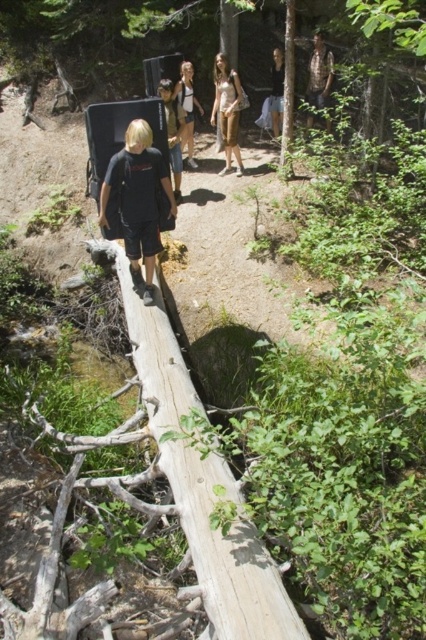
Between black matte shirt at center and light brown fabric dress at center, which one is positioned higher?

light brown fabric dress at center

Can you confirm if black matte shirt at center is taller than light brown fabric dress at center?

In fact, black matte shirt at center may be shorter than light brown fabric dress at center.

Locate an element on the screen. This screenshot has width=426, height=640. black matte shirt at center is located at coordinates pyautogui.click(x=138, y=202).

Can you confirm if black cotton shirt at center is smaller than light brown wooden log at center?

Actually, black cotton shirt at center might be larger than light brown wooden log at center.

Looking at this image, does black cotton shirt at center appear under light brown wooden log at center?

Yes.

Identify the location of black cotton shirt at center. (172, 131).

Can you confirm if camouflage fabric shirt at upper center is thinner than matte white tank top at center?

In fact, camouflage fabric shirt at upper center might be wider than matte white tank top at center.

Does camouflage fabric shirt at upper center have a larger size compared to matte white tank top at center?

Answer: Incorrect, camouflage fabric shirt at upper center is not larger than matte white tank top at center.

Find the location of `camouflage fabric shirt at upper center`. camouflage fabric shirt at upper center is located at coordinates (319, 72).

The height and width of the screenshot is (640, 426). Find the location of `camouflage fabric shirt at upper center`. camouflage fabric shirt at upper center is located at coordinates (319, 72).